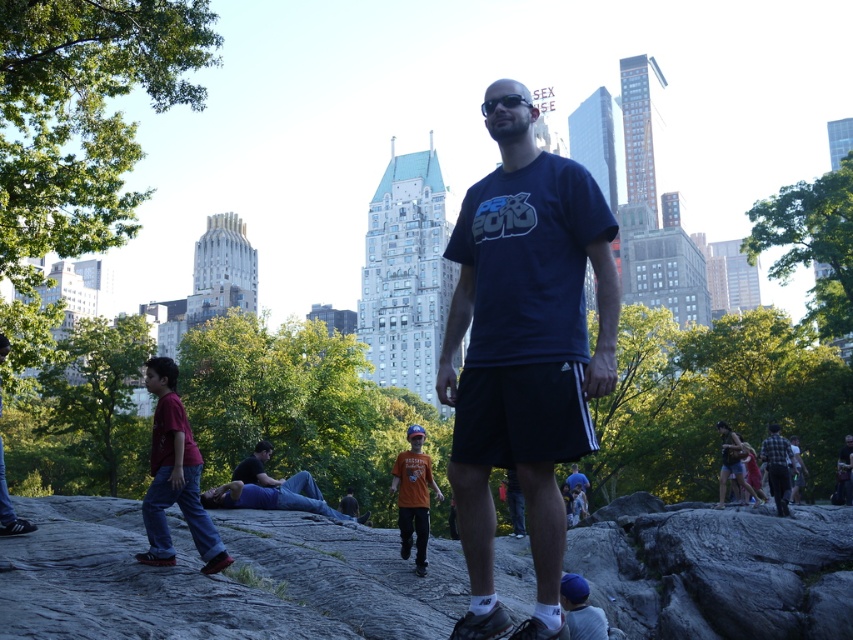
Is the position of navy blue t-shirt at center more distant than that of dark blue shirt at center?

No, it is not.

Is point (514, 378) farther from camera compared to point (247, 474)?

No, it is in front of (247, 474).

Locate an element on the screen. The height and width of the screenshot is (640, 853). navy blue t-shirt at center is located at coordinates (523, 349).

Is navy blue t-shirt at center thinner than matte black shorts at lower right?

No, navy blue t-shirt at center is not thinner than matte black shorts at lower right.

Does navy blue t-shirt at center have a greater height compared to matte black shorts at lower right?

Indeed, navy blue t-shirt at center has a greater height compared to matte black shorts at lower right.

What do you see at coordinates (523, 349) in the screenshot?
I see `navy blue t-shirt at center` at bounding box center [523, 349].

Locate an element on the screen. This screenshot has width=853, height=640. navy blue t-shirt at center is located at coordinates coord(523,349).

Who is positioned more to the left, navy blue t-shirt at center or flannel shirt at right?

Positioned to the left is navy blue t-shirt at center.

Can you confirm if navy blue t-shirt at center is taller than flannel shirt at right?

Correct, navy blue t-shirt at center is much taller as flannel shirt at right.

Identify the location of navy blue t-shirt at center. (523, 349).